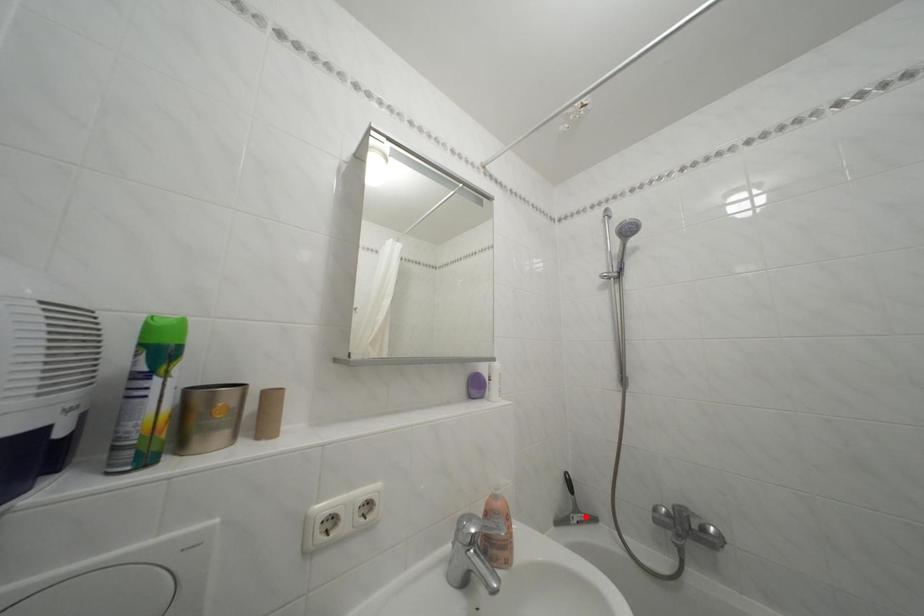
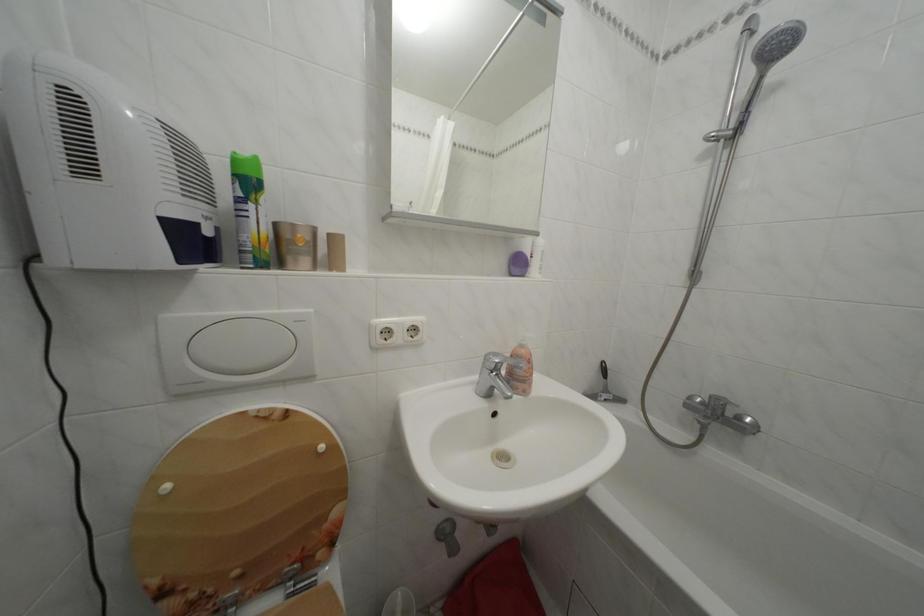
Question: I am providing you with two images of the same scene from different viewpoints. A red point is shown in image1. For the corresponding object point in image2, is it positioned nearer or farther from the camera?

Choices:
 (A) Nearer
 (B) Farther

Answer: (B)